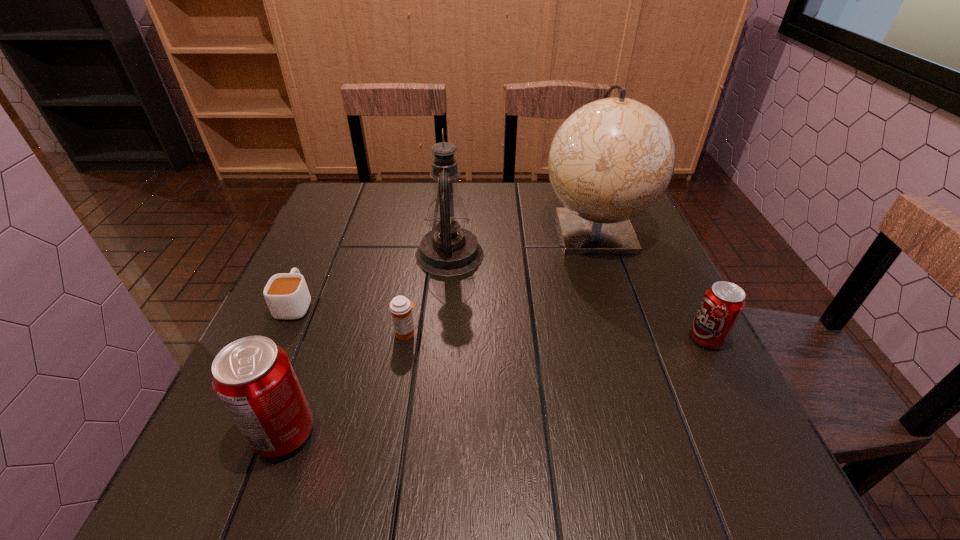
Image resolution: width=960 pixels, height=540 pixels. Find the location of `free space located 0.130m on the front of the farther soda`. free space located 0.130m on the front of the farther soda is located at coordinates (742, 410).

What are the coordinates of `vacant space located 0.340m on the front of the oil lamp` in the screenshot? It's located at (437, 403).

Where is `free space located on the surface of the globe showing Europe and Africa`? The width and height of the screenshot is (960, 540). free space located on the surface of the globe showing Europe and Africa is located at coordinates (644, 377).

Where is `free location located 0.050m on the side with the handle of the fourth nearest object`? The height and width of the screenshot is (540, 960). free location located 0.050m on the side with the handle of the fourth nearest object is located at coordinates (310, 272).

The width and height of the screenshot is (960, 540). I want to click on vacant position located on the side with the handle of the fourth nearest object, so click(338, 209).

The image size is (960, 540). What are the coordinates of `free region located 0.170m on the side with the handle of the fourth nearest object` in the screenshot? It's located at (324, 242).

Locate an element on the screen. The image size is (960, 540). vacant region located on the right of the medicine is located at coordinates (598, 333).

Locate an element on the screen. This screenshot has width=960, height=540. object situated at the far edge is located at coordinates (612, 159).

In order to click on object present at the near edge in this screenshot , I will do coord(253,378).

The image size is (960, 540). Identify the location of soda that is at the left edge. (253, 378).